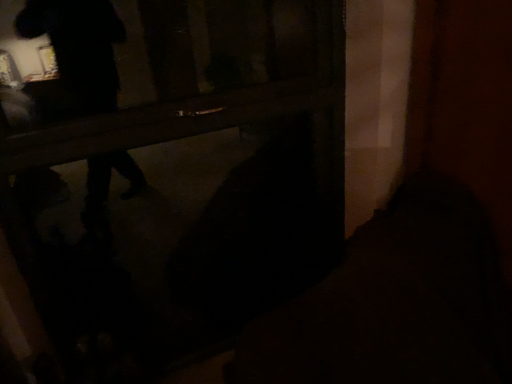
Question: Looking at their shapes, would you say black matte bag at lower center is wider or thinner than wooden door at center?

Choices:
 (A) wide
 (B) thin

Answer: (A)

Question: From the image's perspective, is black matte bag at lower center located above or below wooden door at center?

Choices:
 (A) above
 (B) below

Answer: (B)

Question: Is black matte bag at lower center taller or shorter than wooden door at center?

Choices:
 (A) tall
 (B) short

Answer: (B)

Question: Is point (14, 150) closer or farther from the camera than point (380, 354)?

Choices:
 (A) closer
 (B) farther

Answer: (B)

Question: In terms of size, does wooden door at center appear bigger or smaller than black matte bag at lower center?

Choices:
 (A) small
 (B) big

Answer: (A)

Question: In the image, is wooden door at center on the left side or the right side of black matte bag at lower center?

Choices:
 (A) right
 (B) left

Answer: (B)

Question: Is wooden door at center in front of or behind black matte bag at lower center in the image?

Choices:
 (A) behind
 (B) front

Answer: (A)